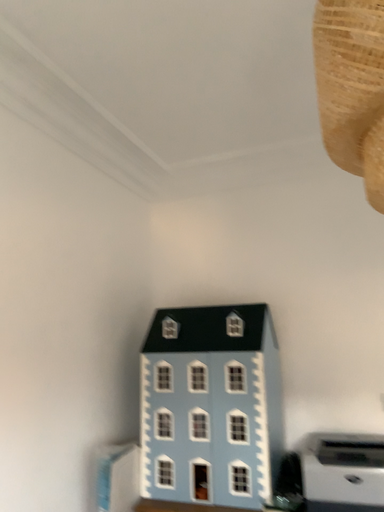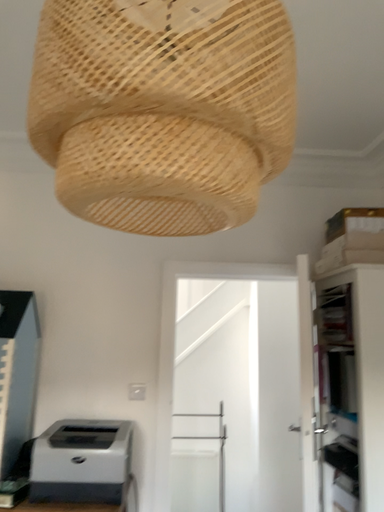
Question: Which way did the camera rotate in the video?

Choices:
 (A) rotated left
 (B) rotated right

Answer: (B)